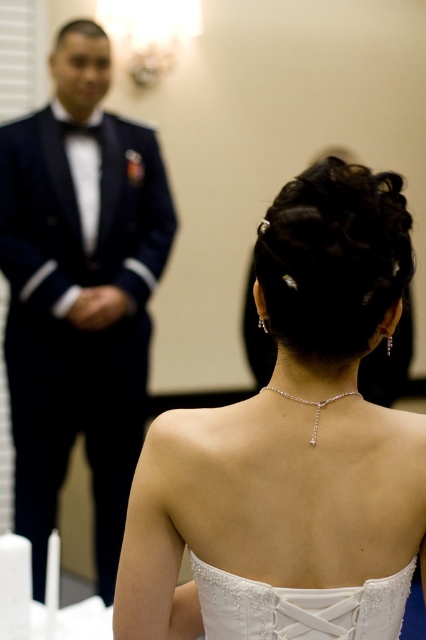
Question: Is white satin dress at center further to camera compared to white lace dress at back?

Choices:
 (A) no
 (B) yes

Answer: (A)

Question: Which point is farther to the camera?

Choices:
 (A) white lace dress at back
 (B) shiny black suit at left
 (C) white satin dress at center

Answer: (B)

Question: In this image, where is white satin dress at center located relative to shiny black suit at left?

Choices:
 (A) right
 (B) left

Answer: (A)

Question: Which is farther from the white satin dress at center?

Choices:
 (A) shiny black suit at left
 (B) white lace dress at back

Answer: (A)

Question: Which object appears farthest from the camera in this image?

Choices:
 (A) shiny black suit at left
 (B) white satin dress at center
 (C) white lace dress at back

Answer: (A)

Question: From the image, what is the correct spatial relationship of white satin dress at center in relation to shiny black suit at left?

Choices:
 (A) right
 (B) left

Answer: (A)